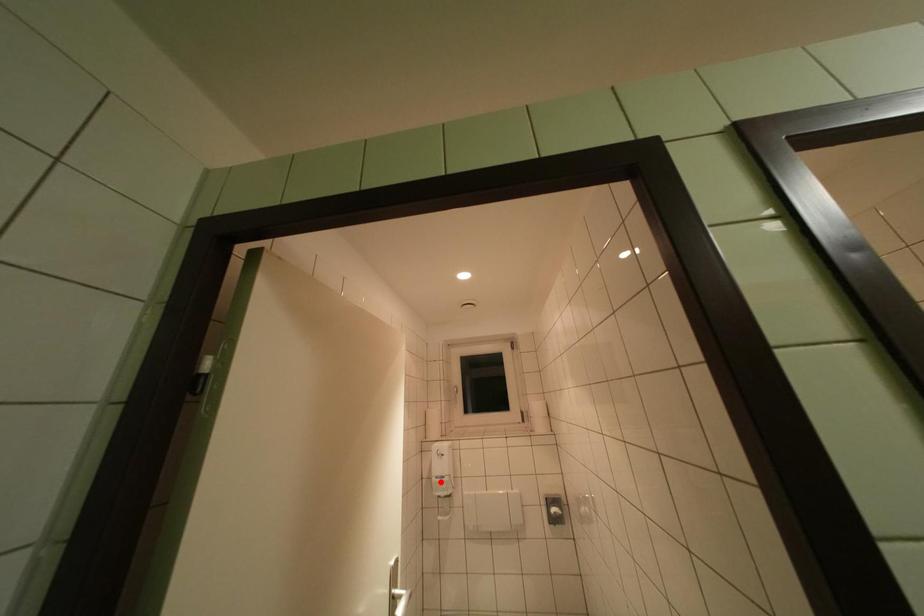
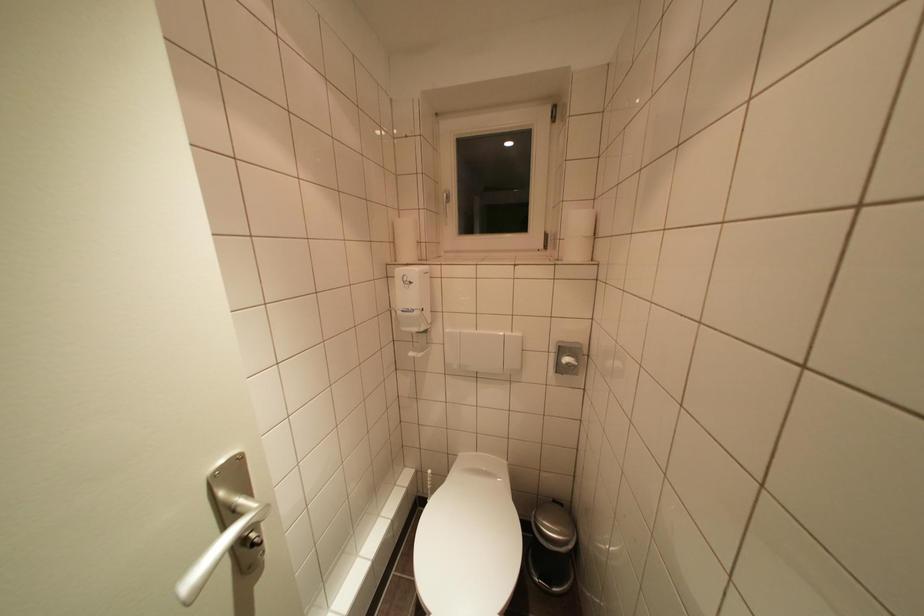
In the second image, find the point that corresponds to the highlighted location in the first image.

(406, 315)